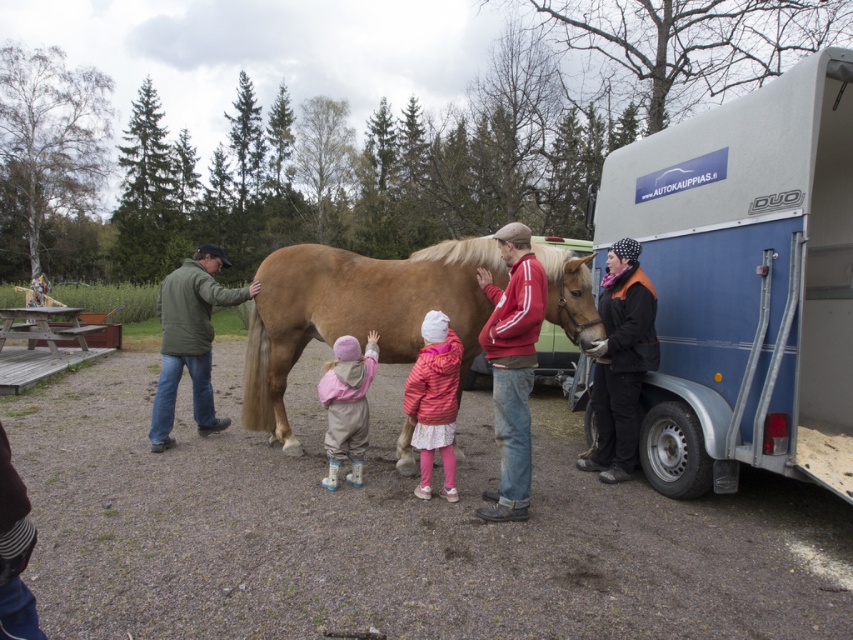
Who is more forward, (x=163, y=394) or (x=363, y=378)?

Positioned in front is point (x=363, y=378).

Is green matte jacket at left wider than light pink fleece jacket at center?

Indeed, green matte jacket at left has a greater width compared to light pink fleece jacket at center.

This screenshot has height=640, width=853. What are the coordinates of `green matte jacket at left` in the screenshot? It's located at (x=190, y=339).

Measure the distance between blue metallic camper at right and camera.

blue metallic camper at right and camera are 3.99 meters apart from each other.

Between blue metallic camper at right and golden brown fur at center, which one appears on the left side from the viewer's perspective?

Positioned to the left is golden brown fur at center.

Image resolution: width=853 pixels, height=640 pixels. I want to click on blue metallic camper at right, so click(x=746, y=282).

Looking at this image, who is shorter, golden brown fur at center or black fleece jacket at right?

golden brown fur at center is shorter.

Which is below, golden brown fur at center or black fleece jacket at right?

black fleece jacket at right is lower down.

Who is more forward, (448, 310) or (651, 324)?

Positioned in front is point (651, 324).

In order to click on golden brown fur at center in this screenshot , I will do `click(355, 312)`.